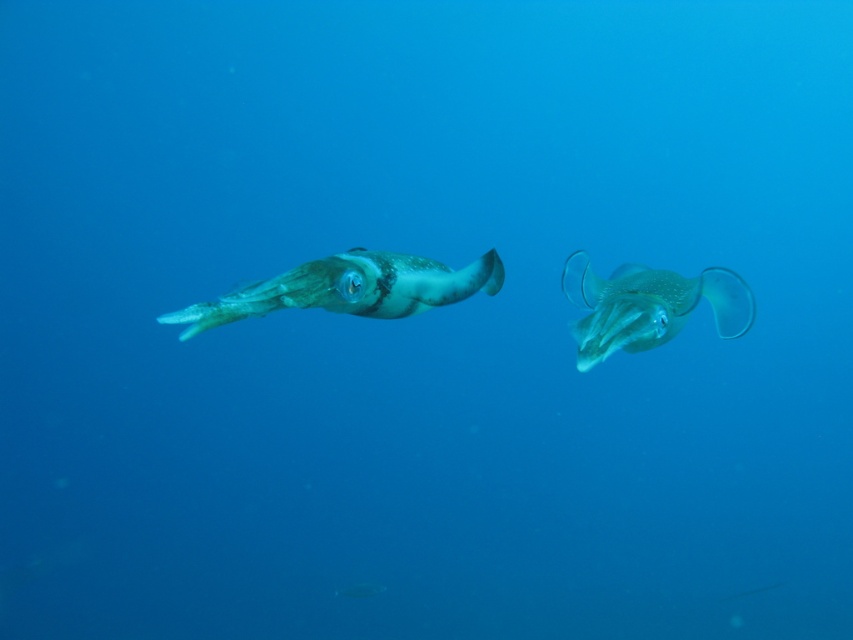
Is translucent green squid at left to the right of translucent rubber squid at center from the viewer's perspective?

Incorrect, translucent green squid at left is not on the right side of translucent rubber squid at center.

Is translucent green squid at left shorter than translucent rubber squid at center?

Yes.

Is point (347, 264) in front of point (724, 337)?

Yes, point (347, 264) is in front of point (724, 337).

The image size is (853, 640). Identify the location of translucent green squid at left. (349, 289).